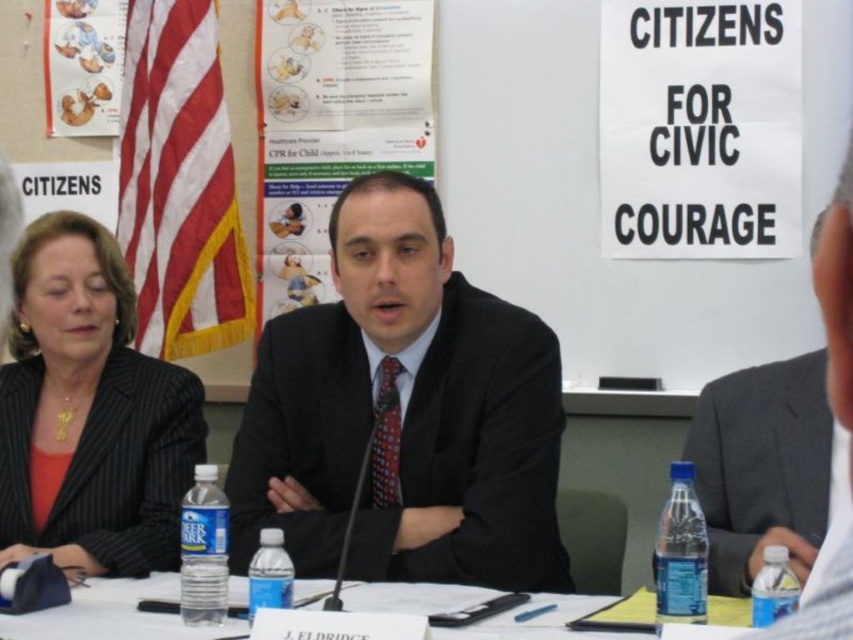
Question: Which object is the closest to the white paperboard at center?

Choices:
 (A) paper with printed text at center
 (B) black matte suit at right
 (C) black paper sign at upper right

Answer: (B)

Question: Is black suit at center closer to camera compared to black paper sign at upper right?

Choices:
 (A) no
 (B) yes

Answer: (B)

Question: Which point is closer to the camera?

Choices:
 (A) paper with printed text at center
 (B) black matte suit at right
 (C) white paperboard at center
 (D) black paper sign at upper right

Answer: (C)

Question: Which is nearer to the black suit at center?

Choices:
 (A) white paperboard at center
 (B) black pinstripe suit at left
 (C) black paper sign at upper right
 (D) paper with printed text at center

Answer: (A)

Question: Does black paper sign at upper right appear on the left side of paper with printed text at center?

Choices:
 (A) yes
 (B) no

Answer: (B)

Question: Is black matte suit at right behind white paperboard at center?

Choices:
 (A) no
 (B) yes

Answer: (B)